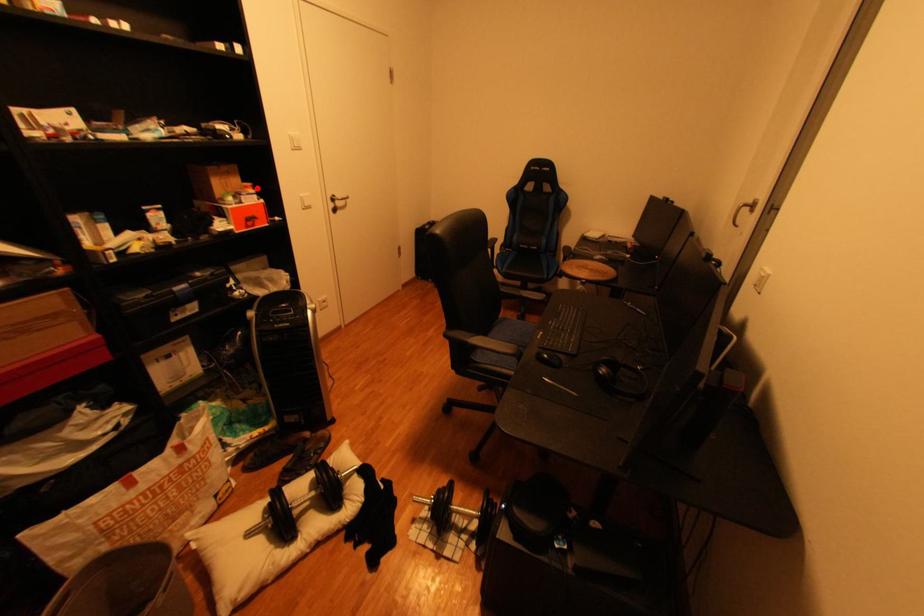
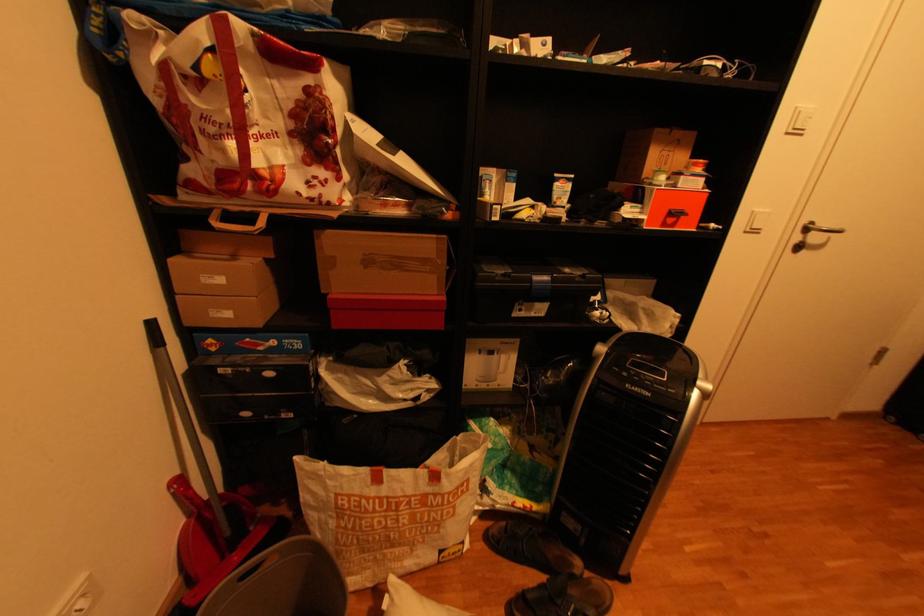
Locate, in the second image, the point that corresponds to the highlighted location in the first image.

(704, 166)